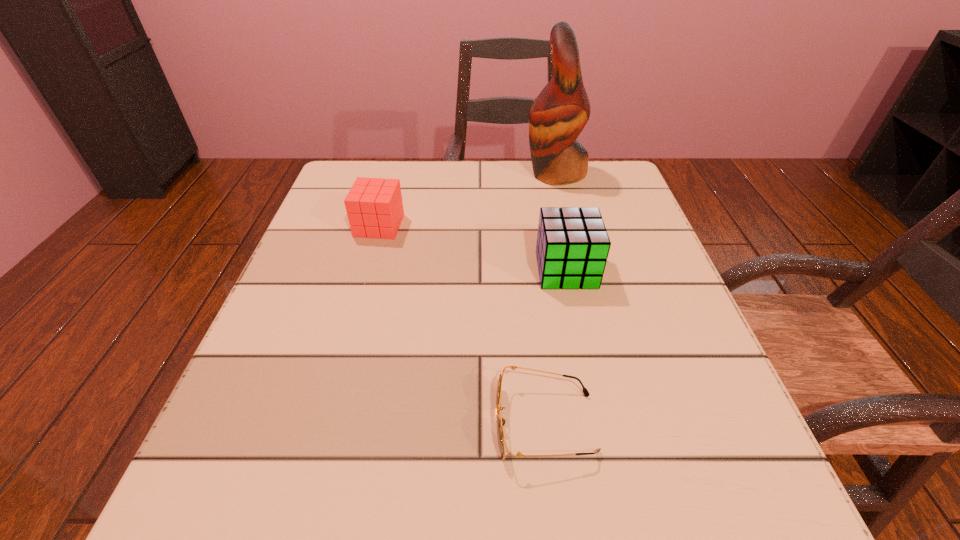
You are a GUI agent. You are given a task and a screenshot of the screen. Output one action in this format:
    pyautogui.click(x=<x>, y=<y>)
    Task: Click on the free location located on the face of the farthest object
    
    Given the screenshot: What is the action you would take?
    pyautogui.click(x=481, y=173)

In order to click on vacant area situated on the left of the nearer cube in this screenshot , I will do `click(375, 270)`.

Identify the location of free space located 0.350m on the front of the shorter cube. (334, 386).

Find the location of a particular element. vacant region located on the front-facing side of the sunglasses is located at coordinates (228, 423).

Where is `vacant space located 0.160m on the front-facing side of the sunglasses`? This screenshot has width=960, height=540. vacant space located 0.160m on the front-facing side of the sunglasses is located at coordinates (379, 423).

Identify the location of vacant space located 0.210m on the front-facing side of the sunglasses. The height and width of the screenshot is (540, 960). (344, 423).

Identify the location of parrot that is at the far edge. The height and width of the screenshot is (540, 960). (558, 115).

I want to click on cube that is at the far edge, so click(x=374, y=207).

Identify the location of object present at the near edge. (501, 422).

I want to click on object that is at the left edge, so click(374, 207).